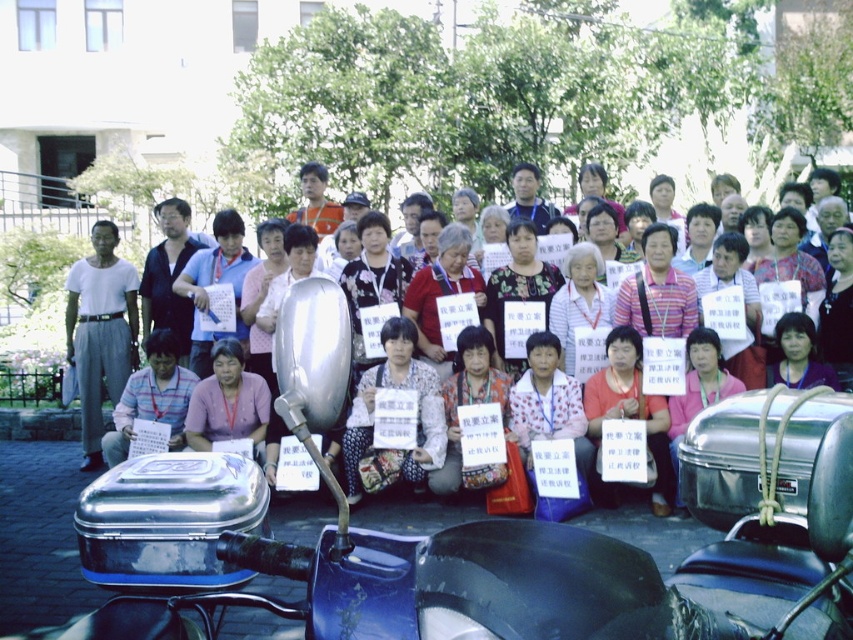
Does point (201, 356) come behind point (234, 368)?

That is True.

Where is `silver metallic helmet at center`? This screenshot has height=640, width=853. silver metallic helmet at center is located at coordinates (660, 289).

The height and width of the screenshot is (640, 853). I want to click on silver metallic helmet at center, so click(x=660, y=289).

Is silver metallic helmet at center positioned behind white cotton shirt at left?

No, silver metallic helmet at center is closer to the viewer.

Does point (840, 257) come farther from viewer compared to point (74, 340)?

That is False.

You are a GUI agent. You are given a task and a screenshot of the screen. Output one action in this format:
    pyautogui.click(x=<x>, y=<y>)
    Task: Click on the silver metallic helmet at center
    
    Given the screenshot: What is the action you would take?
    pyautogui.click(x=660, y=289)

Who is higher up, silver metallic helmet at center or matte black sign at center?

Positioned higher is silver metallic helmet at center.

Does silver metallic helmet at center appear on the right side of matte black sign at center?

No, silver metallic helmet at center is not to the right of matte black sign at center.

The height and width of the screenshot is (640, 853). What do you see at coordinates (660, 289) in the screenshot? I see `silver metallic helmet at center` at bounding box center [660, 289].

Identify the location of silver metallic helmet at center. Image resolution: width=853 pixels, height=640 pixels. (660, 289).